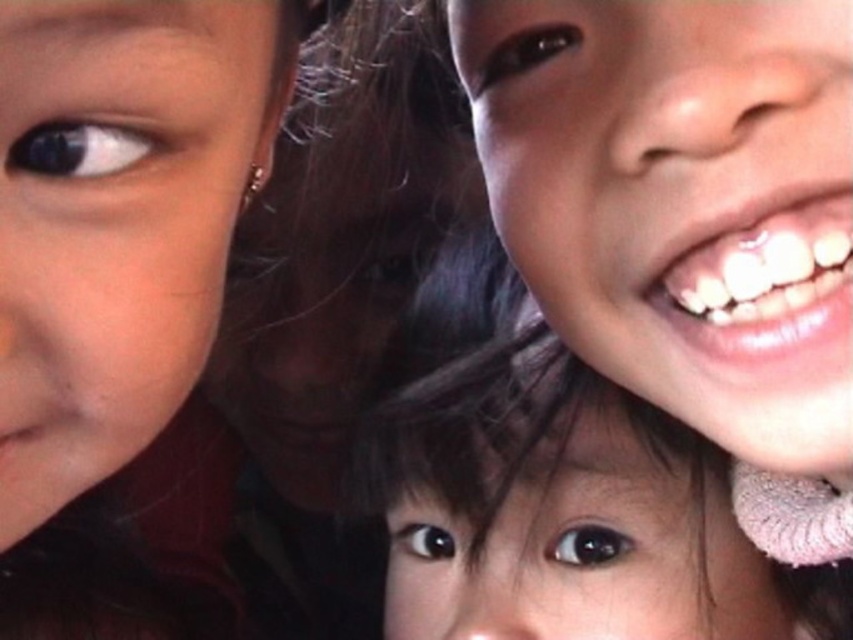
You are a photographer trying to adjust the lighting for a portrait. You notice two faces in your frame, the smooth skin face at right and the matte skin at left. Which face will require less fill light to reduce shadows?

The smooth skin face at right is further to the viewer than matte skin at left, so it will require less fill light to reduce shadows because it is closer to the light source.

Looking at the three children in the image, you notice two distinct skin textures on the faces. The smooth skin face at right and the matte skin at left. Which of these two faces has a greater width?

The smooth skin face at right has a greater width than the matte skin at left.

What are the coordinates of the matte skin at left in the image?

The matte skin at left is located at coordinates point (115,221).